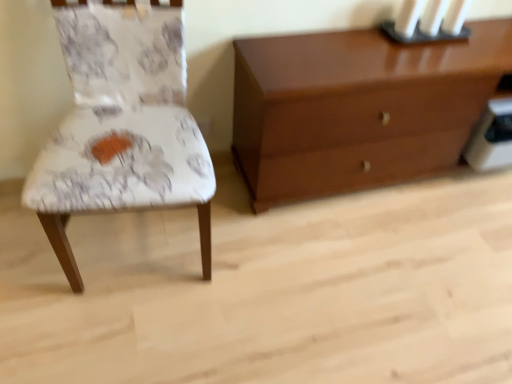
I want to click on free area in between white fabric chair at left and glossy wood chest of drawers at upper right, so click(317, 225).